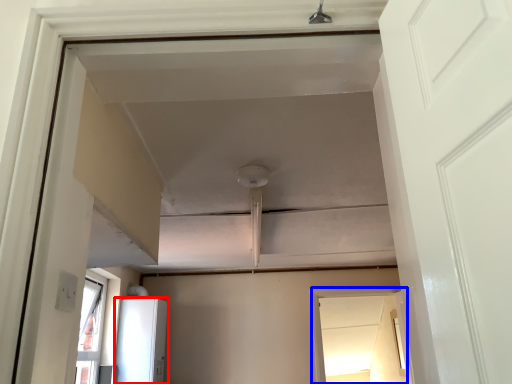
Question: Which of the following is the farthest to the observer, appliance (highlighted by a red box) or window (highlighted by a blue box)?

Choices:
 (A) appliance
 (B) window

Answer: (B)